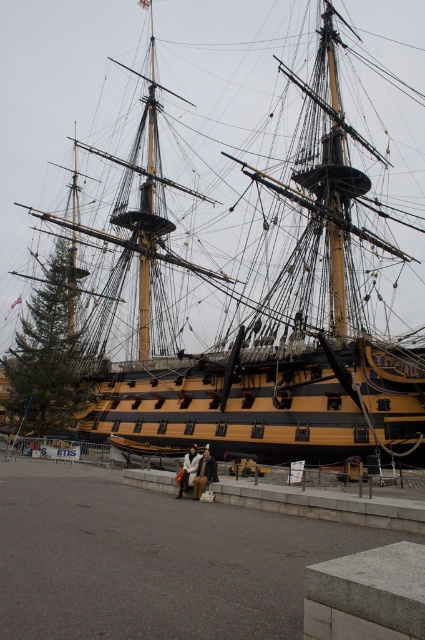
Who is higher up, yellow polished wood ship at center or white wool coat at center?

yellow polished wood ship at center is above.

The width and height of the screenshot is (425, 640). In order to click on yellow polished wood ship at center in this screenshot , I will do `click(246, 237)`.

Can you confirm if yellow polished wood ship at center is positioned above brown leather jacket at center?

Indeed, yellow polished wood ship at center is positioned over brown leather jacket at center.

Which is behind, point (102, 305) or point (203, 470)?

Positioned behind is point (102, 305).

The height and width of the screenshot is (640, 425). What do you see at coordinates (246, 237) in the screenshot?
I see `yellow polished wood ship at center` at bounding box center [246, 237].

Locate an element on the screen. yellow polished wood ship at center is located at coordinates (246, 237).

Does brown leather jacket at center appear over white wool coat at center?

No.

Locate an element on the screen. This screenshot has width=425, height=640. brown leather jacket at center is located at coordinates (204, 474).